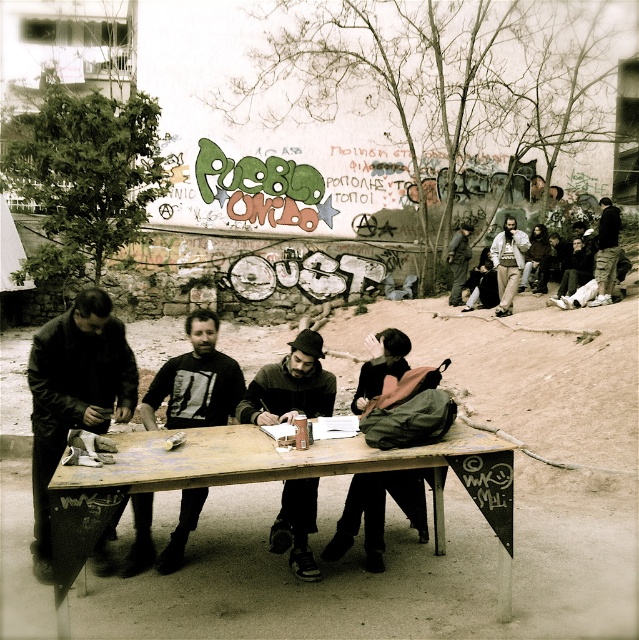
Question: Which point is farther to the camera?

Choices:
 (A) camouflage pants at right
 (B) beige fabric jacket at upper right
 (C) black matte shirt at center
 (D) dark gray sweater at center

Answer: (B)

Question: Which point appears closest to the camera in this image?

Choices:
 (A) (601, 202)
 (B) (167, 417)

Answer: (B)

Question: Which is farther from the camouflage pants at right?

Choices:
 (A) dark gray sweater at center
 (B) dark brown leather jacket at left

Answer: (B)

Question: Can you confirm if dark gray sweater at center is wider than camouflage pants at right?

Choices:
 (A) yes
 (B) no

Answer: (B)

Question: Considering the relative positions of dark gray sweater at center and dark green backpack at center in the image provided, where is dark gray sweater at center located with respect to dark green backpack at center?

Choices:
 (A) above
 (B) below

Answer: (A)

Question: Can you confirm if wooden table at center is thinner than dark gray sweater at center?

Choices:
 (A) no
 (B) yes

Answer: (A)